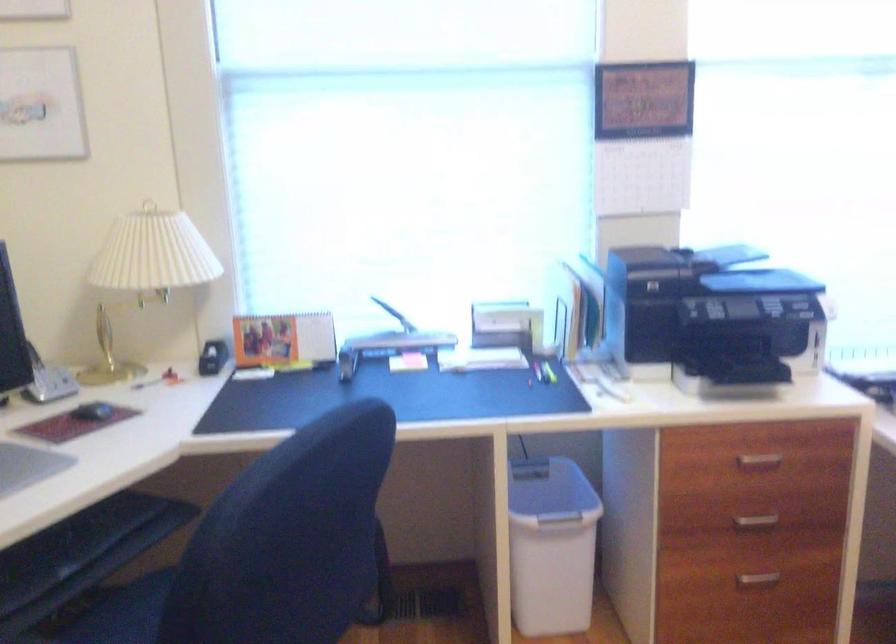
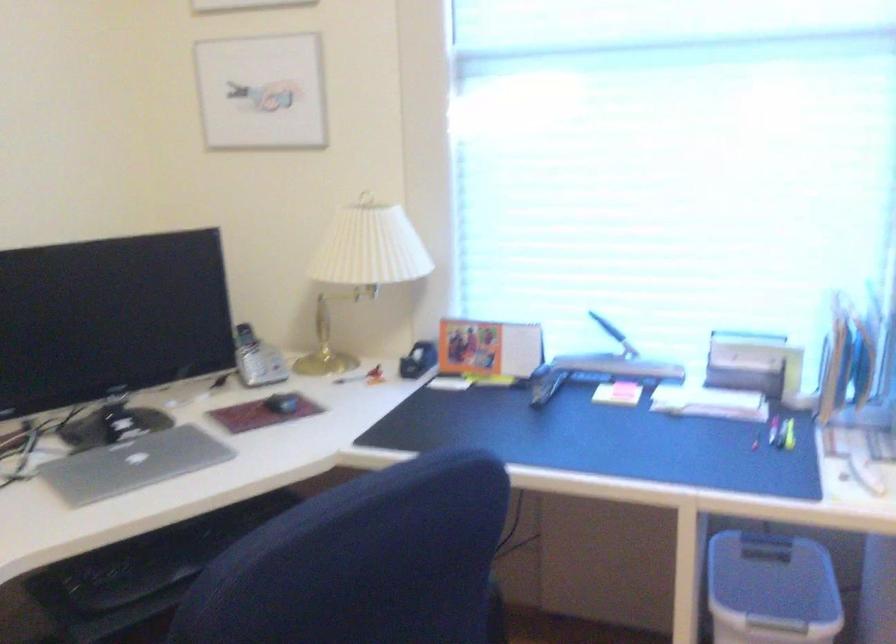
Question: The camera is either moving clockwise (left) or counter-clockwise (right) around the object. The first image is from the beginning of the video and the second image is from the end. Is the camera moving left or right when shooting the video?

Choices:
 (A) Left
 (B) Right

Answer: (B)